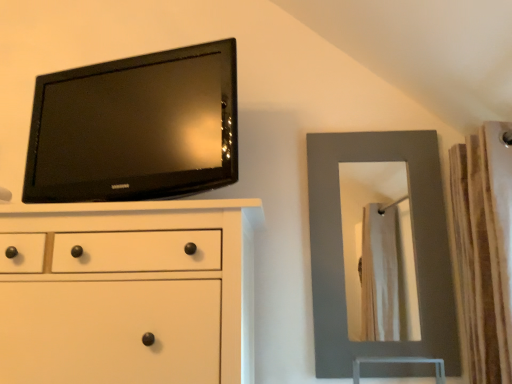
What is the approximate height of matte white chest of drawers at upper left?

matte white chest of drawers at upper left is 23.14 inches in height.

Locate an element on the screen. The width and height of the screenshot is (512, 384). brown textured curtain at right is located at coordinates pos(484,250).

Where is `matte gray mirror at right`? The width and height of the screenshot is (512, 384). matte gray mirror at right is located at coordinates (413, 243).

Considering the relative sizes of matte white chest of drawers at upper left and matte gray mirror at right in the image provided, is matte white chest of drawers at upper left shorter than matte gray mirror at right?

Yes, matte white chest of drawers at upper left is shorter than matte gray mirror at right.

Can you confirm if matte white chest of drawers at upper left is positioned to the left of matte gray mirror at right?

Indeed, matte white chest of drawers at upper left is positioned on the left side of matte gray mirror at right.

Is matte white chest of drawers at upper left positioned with its back to matte gray mirror at right?

No, matte white chest of drawers at upper left's orientation is not away from matte gray mirror at right.

Relative to matte gray mirror at right, is matte white chest of drawers at upper left in front or behind?

Visually, matte white chest of drawers at upper left is located in front of matte gray mirror at right.

Is matte gray mirror at right positioned beyond the bounds of black glossy tv at upper left?

matte gray mirror at right lies outside black glossy tv at upper left's area.

From a real-world perspective, is matte gray mirror at right under black glossy tv at upper left?

Yes, from a real-world perspective, matte gray mirror at right is below black glossy tv at upper left.

Is matte gray mirror at right with black glossy tv at upper left?

No, matte gray mirror at right is not making contact with black glossy tv at upper left.

Consider the image. Which object is further away from the camera taking this photo, matte gray mirror at right or black glossy tv at upper left?

matte gray mirror at right is further from the camera.

Which object is wider, black glossy tv at upper left or brown textured curtain at right?

brown textured curtain at right is wider.

Does black glossy tv at upper left have a larger size compared to brown textured curtain at right?

No, black glossy tv at upper left is not bigger than brown textured curtain at right.

Is black glossy tv at upper left outside of brown textured curtain at right?

That's correct, black glossy tv at upper left is outside of brown textured curtain at right.

From the image's perspective, which object appears higher, black glossy tv at upper left or brown textured curtain at right?

black glossy tv at upper left, from the image's perspective.

Which object is closer to the camera taking this photo, matte gray mirror at right or brown textured curtain at right?

brown textured curtain at right is more forward.

Would you say matte gray mirror at right is to the left or to the right of brown textured curtain at right in the picture?

matte gray mirror at right is to the left of brown textured curtain at right.

Consider the image. From the image's perspective, is matte gray mirror at right positioned above or below brown textured curtain at right?

Clearly, from the image's perspective, matte gray mirror at right is below brown textured curtain at right.

Is matte gray mirror at right positioned far away from brown textured curtain at right?

No, matte gray mirror at right is not far away from brown textured curtain at right.

Is matte white chest of drawers at upper left facing away from brown textured curtain at right?

No.

From a real-world perspective, is matte white chest of drawers at upper left located beneath brown textured curtain at right?

Yes, from a real-world perspective, matte white chest of drawers at upper left is beneath brown textured curtain at right.

From the picture: Considering the relative sizes of matte white chest of drawers at upper left and brown textured curtain at right in the image provided, is matte white chest of drawers at upper left taller than brown textured curtain at right?

In fact, matte white chest of drawers at upper left may be shorter than brown textured curtain at right.

In order to click on chest of drawers on the left of brown textured curtain at right in this screenshot , I will do `click(128, 292)`.

Can you tell me how much brown textured curtain at right and matte gray mirror at right differ in facing direction?

The facing directions of brown textured curtain at right and matte gray mirror at right are 87.8 degrees apart.

Which point is more forward, (498, 372) or (453, 289)?

The point (498, 372) is closer to the camera.

Is matte gray mirror at right at the back of brown textured curtain at right?

That's not correct — brown textured curtain at right is not looking away from matte gray mirror at right.

Is brown textured curtain at right spatially inside matte gray mirror at right, or outside of it?

brown textured curtain at right is spatially situated outside matte gray mirror at right.

In terms of height, does matte gray mirror at right look taller or shorter compared to matte white chest of drawers at upper left?

In the image, matte gray mirror at right appears to be taller than matte white chest of drawers at upper left.

Is matte gray mirror at right far from matte white chest of drawers at upper left?

matte gray mirror at right is actually quite close to matte white chest of drawers at upper left.

Is the depth of matte gray mirror at right less than that of matte white chest of drawers at upper left?

That is False.

This screenshot has width=512, height=384. I want to click on the chest of drawers in front of the matte gray mirror at right, so click(128, 292).

What are the coordinates of `mirror beneath the black glossy tv at upper left (from a real-world perspective)` in the screenshot? It's located at (413, 243).

When comparing their distances from matte gray mirror at right, does brown textured curtain at right or matte white chest of drawers at upper left seem further?

matte white chest of drawers at upper left is further to matte gray mirror at right.

Estimate the real-world distances between objects in this image. Which object is further from black glossy tv at upper left, brown textured curtain at right or matte gray mirror at right?

Among the two, brown textured curtain at right is located further to black glossy tv at upper left.

From the image, which object appears to be farther from black glossy tv at upper left, brown textured curtain at right or matte white chest of drawers at upper left?

The object further to black glossy tv at upper left is brown textured curtain at right.

From the picture: Looking at the image, which one is located closer to black glossy tv at upper left, matte white chest of drawers at upper left or brown textured curtain at right?

Based on the image, matte white chest of drawers at upper left appears to be nearer to black glossy tv at upper left.

From the image, which object appears to be farther from black glossy tv at upper left, matte white chest of drawers at upper left or matte gray mirror at right?

Based on the image, matte gray mirror at right appears to be further to black glossy tv at upper left.

Looking at the image, which one is located closer to brown textured curtain at right, matte gray mirror at right or black glossy tv at upper left?

The object closer to brown textured curtain at right is matte gray mirror at right.

Considering their positions, is brown textured curtain at right positioned further to matte gray mirror at right than black glossy tv at upper left?

black glossy tv at upper left is positioned further to the anchor matte gray mirror at right.

Which object lies further to the anchor point matte white chest of drawers at upper left, black glossy tv at upper left or brown textured curtain at right?

brown textured curtain at right is positioned further to the anchor matte white chest of drawers at upper left.

The width and height of the screenshot is (512, 384). I want to click on television situated between matte white chest of drawers at upper left and matte gray mirror at right from left to right, so click(x=136, y=128).

Find the location of a particular element. This screenshot has height=384, width=512. television located between matte white chest of drawers at upper left and brown textured curtain at right in the left-right direction is located at coordinates (136, 128).

You are a GUI agent. You are given a task and a screenshot of the screen. Output one action in this format:
    pyautogui.click(x=<x>, y=<y>)
    Task: Click on the mirror between matte white chest of drawers at upper left and brown textured curtain at right from left to right
    The height and width of the screenshot is (384, 512).
    Given the screenshot: What is the action you would take?
    point(413,243)

Where is `mirror between black glossy tv at upper left and brown textured curtain at right from left to right`? Image resolution: width=512 pixels, height=384 pixels. mirror between black glossy tv at upper left and brown textured curtain at right from left to right is located at coordinates (413, 243).